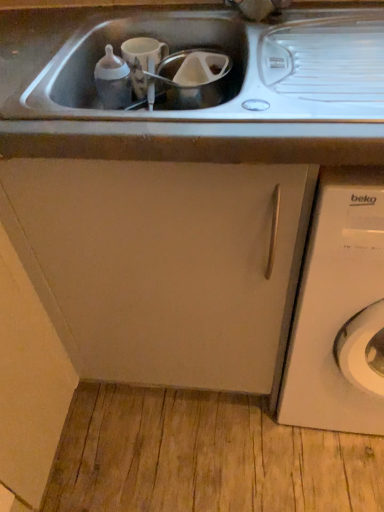
The image size is (384, 512). What do you see at coordinates (163, 264) in the screenshot?
I see `matte white cabinet at center` at bounding box center [163, 264].

Locate an element on the screen. The height and width of the screenshot is (512, 384). matte white cabinet at center is located at coordinates (163, 264).

Image resolution: width=384 pixels, height=512 pixels. What do you see at coordinates (339, 310) in the screenshot?
I see `white matte washing machine at right` at bounding box center [339, 310].

Where is `white matte washing machine at right`? white matte washing machine at right is located at coordinates (339, 310).

Locate an element on the screen. This screenshot has width=384, height=512. matte white cabinet at center is located at coordinates (163, 264).

Would you say matte white cabinet at center is to the left or to the right of white matte washing machine at right in the picture?

Clearly, matte white cabinet at center is on the left of white matte washing machine at right in the image.

Is matte white cabinet at center in front of or behind white matte washing machine at right in the image?

matte white cabinet at center is behind white matte washing machine at right.

Is point (210, 192) less distant than point (377, 274)?

Yes, it is.

From the image's perspective, which is above, matte white cabinet at center or white matte washing machine at right?

matte white cabinet at center appears higher in the image.

From a real-world perspective, is matte white cabinet at center physically above white matte washing machine at right?

Yes.

Considering the relative sizes of matte white cabinet at center and white matte washing machine at right in the image provided, is matte white cabinet at center wider than white matte washing machine at right?

No, matte white cabinet at center is not wider than white matte washing machine at right.

Who is shorter, matte white cabinet at center or white matte washing machine at right?

matte white cabinet at center.

Based on their sizes in the image, would you say matte white cabinet at center is bigger or smaller than white matte washing machine at right?

In the image, matte white cabinet at center appears to be larger than white matte washing machine at right.

Is matte white cabinet at center spatially inside white matte washing machine at right, or outside of it?

matte white cabinet at center is outside white matte washing machine at right.

Is matte white cabinet at center directly adjacent to white matte washing machine at right?

No, matte white cabinet at center is not in contact with white matte washing machine at right.

Could you tell me if matte white cabinet at center is turned towards white matte washing machine at right?

No, matte white cabinet at center is not aimed at white matte washing machine at right.

How many degrees apart are the facing directions of matte white cabinet at center and white matte washing machine at right?

The angle between the facing direction of matte white cabinet at center and the facing direction of white matte washing machine at right is 0.261 degrees.

Where is `cabinetry that appears on the left of white matte washing machine at right`? The image size is (384, 512). cabinetry that appears on the left of white matte washing machine at right is located at coordinates [163, 264].

Is white matte washing machine at right at the right side of matte white cabinet at center?

Indeed, white matte washing machine at right is positioned on the right side of matte white cabinet at center.

Is the position of white matte washing machine at right less distant than that of matte white cabinet at center?

Yes, white matte washing machine at right is in front of matte white cabinet at center.

Is point (282, 390) closer or farther from the camera than point (111, 314)?

Point (282, 390) is positioned farther from the camera compared to point (111, 314).

From the image's perspective, would you say white matte washing machine at right is positioned over matte white cabinet at center?

Actually, white matte washing machine at right appears below matte white cabinet at center in the image.

From a real-world perspective, is white matte washing machine at right beneath matte white cabinet at center?

Yes, from a real-world perspective, white matte washing machine at right is beneath matte white cabinet at center.

Consider the image. Is white matte washing machine at right wider than matte white cabinet at center?

Correct, the width of white matte washing machine at right exceeds that of matte white cabinet at center.

Considering the sizes of objects white matte washing machine at right and matte white cabinet at center in the image provided, who is shorter, white matte washing machine at right or matte white cabinet at center?

matte white cabinet at center.

Looking at this image, is white matte washing machine at right bigger or smaller than matte white cabinet at center?

white matte washing machine at right is smaller than matte white cabinet at center.

Do you think white matte washing machine at right is within matte white cabinet at center, or outside of it?

white matte washing machine at right exists outside the volume of matte white cabinet at center.

Is white matte washing machine at right far away from matte white cabinet at center?

white matte washing machine at right is actually quite close to matte white cabinet at center.

Is white matte washing machine at right turned away from matte white cabinet at center?

That's not correct — white matte washing machine at right is not looking away from matte white cabinet at center.

This screenshot has height=512, width=384. Find the location of `cabinetry above the white matte washing machine at right (from the image's perspective)`. cabinetry above the white matte washing machine at right (from the image's perspective) is located at coordinates (163, 264).

Locate an element on the screen. This screenshot has width=384, height=512. washing machine below the matte white cabinet at center (from a real-world perspective) is located at coordinates (339, 310).

I want to click on washing machine on the right of the matte white cabinet at center, so click(339, 310).